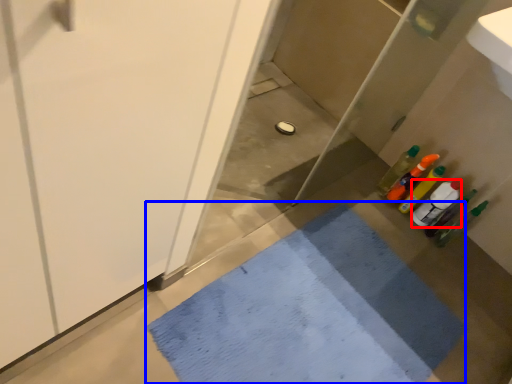
Question: Which object appears farthest to the camera in this image, bottle (highlighted by a red box) or bath mat (highlighted by a blue box)?

Choices:
 (A) bottle
 (B) bath mat

Answer: (A)